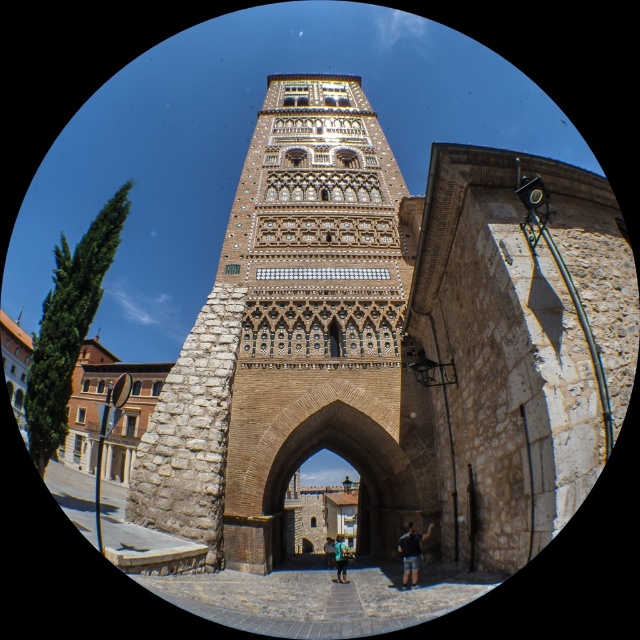
You are organizing a clothing rack and need to place the blue denim jeans at lower center and the blue denim shorts at center. Since space is limited, which item should you place first to ensure both fit properly?

The blue denim jeans at lower center should be placed first because they are larger in size than the blue denim shorts at center, ensuring there is enough space left for the smaller item.

You are standing in front of the tower and notice two points marked on the wall. The first point is at coordinates point (337,540) and the second is at point (328,552). Which point is closer to you?

Point (337,540) is further to the camera than point (328,552), so the closer point to you is point (328,552).

You are standing in the scene and need to place a small decorative plaque exactly at the center of the image. Given the coordinates provided for the blue denim jeans at lower center, can you determine if the plaque should be placed to the left or right of the jeans?

The blue denim jeans at lower center is located at coordinate point 0.872 on the x axis. Since the center of the image is at 0.5, the plaque should be placed to the left of the blue denim jeans at lower center to reach the center.